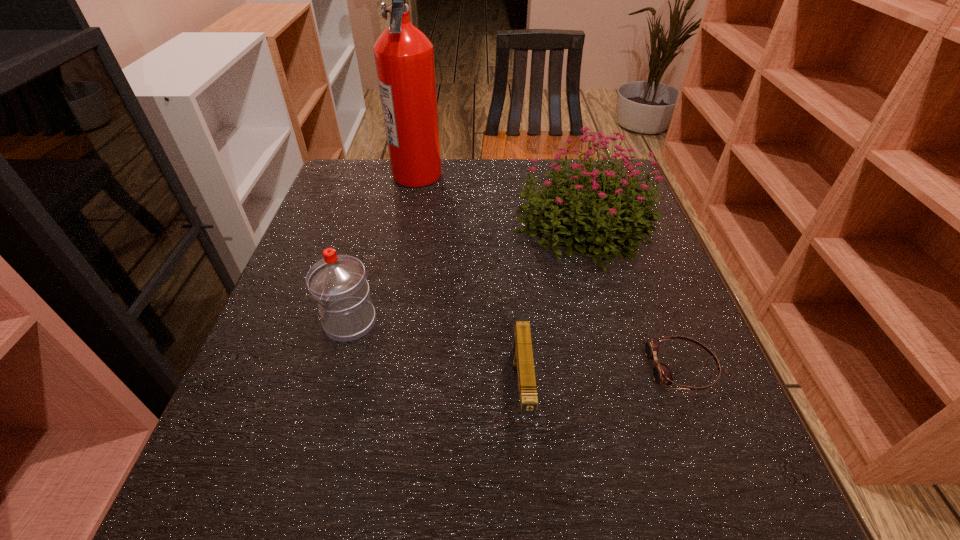
Where is `free region located 0.230m through the lenses of the shortest object`? This screenshot has width=960, height=540. free region located 0.230m through the lenses of the shortest object is located at coordinates (518, 368).

Find the location of a particular element. The height and width of the screenshot is (540, 960). vacant space located 0.110m through the lenses of the shortest object is located at coordinates (587, 368).

In order to click on fire extinguisher at the far edge in this screenshot , I will do `click(404, 56)`.

Locate an element on the screen. bouquet that is at the far edge is located at coordinates (600, 233).

At what (x,y) coordinates should I click in order to perform the action: click on object positioned at the left edge. Please return your answer as a coordinate pair (x, y). Image resolution: width=960 pixels, height=540 pixels. Looking at the image, I should click on (337, 282).

Image resolution: width=960 pixels, height=540 pixels. What are the coordinates of `bouquet present at the right edge` in the screenshot? It's located at (600, 233).

Find the location of `goggles present at the right edge`. goggles present at the right edge is located at coordinates (661, 374).

Where is `object positioned at the far right corner`? The height and width of the screenshot is (540, 960). object positioned at the far right corner is located at coordinates (600, 233).

The image size is (960, 540). In order to click on vacant space at the far edge in this screenshot , I will do `click(442, 195)`.

You are a GUI agent. You are given a task and a screenshot of the screen. Output one action in this format:
    pyautogui.click(x=<x>, y=<y>)
    Task: Click on the free point at the near edge
    The width and height of the screenshot is (960, 540).
    Given the screenshot: What is the action you would take?
    pyautogui.click(x=479, y=505)